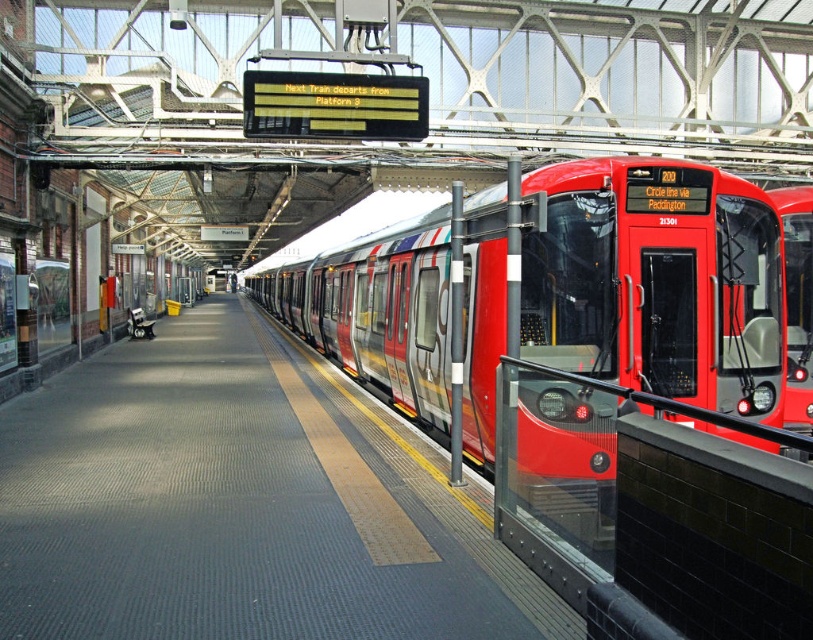
Question: Observing the image, what is the correct spatial positioning of smooth concrete platform at center in reference to metallic red train at center?

Choices:
 (A) right
 (B) left

Answer: (B)

Question: Is smooth concrete platform at center closer to camera compared to metallic red train at center?

Choices:
 (A) no
 (B) yes

Answer: (A)

Question: Can you confirm if smooth concrete platform at center is positioned to the left of metallic red train at center?

Choices:
 (A) no
 (B) yes

Answer: (B)

Question: Among these objects, which one is farthest from the camera?

Choices:
 (A) metallic red train at center
 (B) smooth concrete platform at center

Answer: (B)

Question: Which object is closer to the camera taking this photo?

Choices:
 (A) metallic red train at center
 (B) smooth concrete platform at center

Answer: (A)